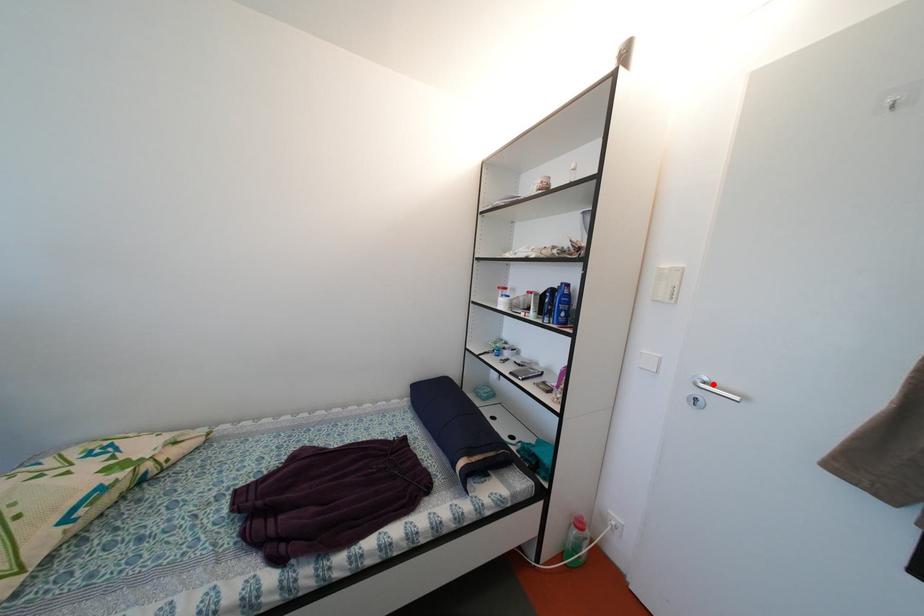
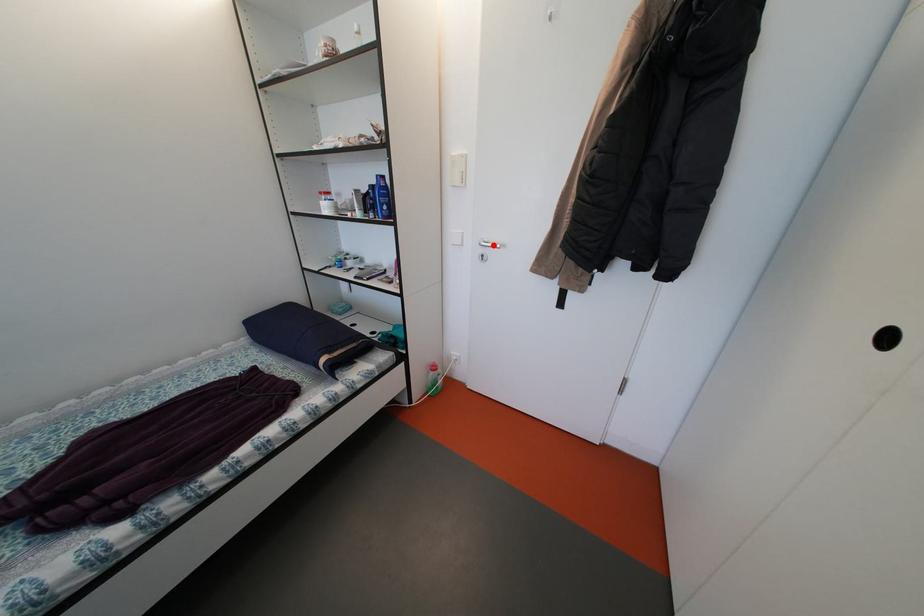
I am providing you with two images of the same scene from different viewpoints. A red point is marked on the first image and another point is marked on the second image. Are the points marked in image1 and image2 representing the same 3D position?

Yes